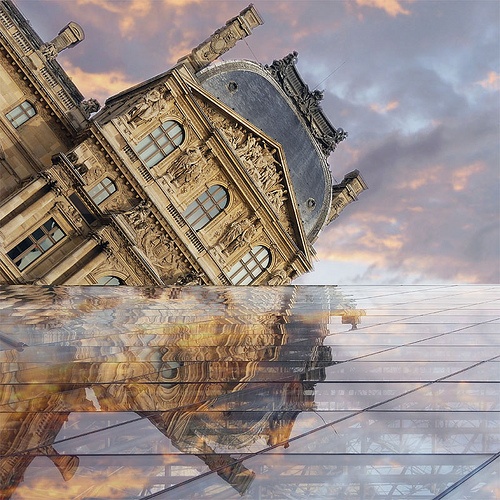
Find the location of a particular element. windows is located at coordinates (157, 139), (202, 206), (254, 259), (43, 243), (17, 115), (114, 280).